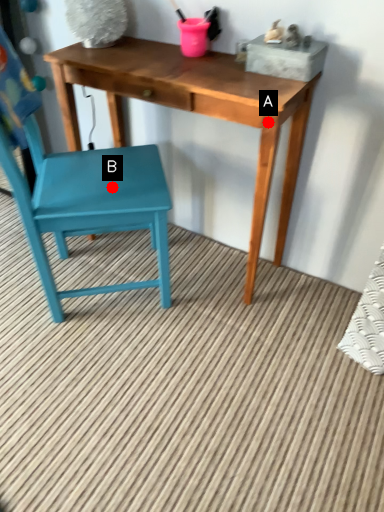
Question: Two points are circled on the image, labeled by A and B beside each circle. Which point is farther from the camera taking this photo?

Choices:
 (A) A is further
 (B) B is further

Answer: (B)